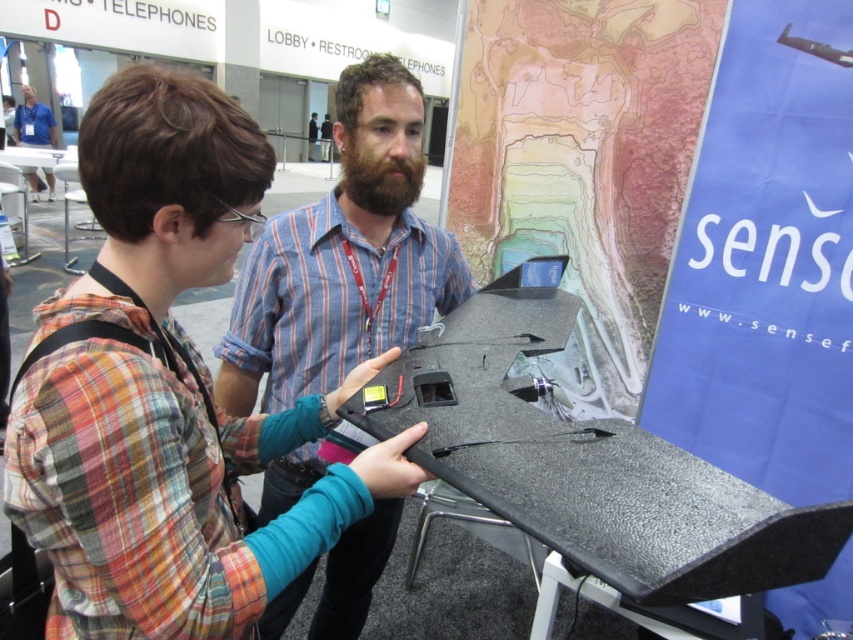
Which is above, plaid shirt at center or matte blue shirt at center?

Positioned higher is plaid shirt at center.

Is plaid shirt at center positioned before matte blue shirt at center?

Yes.

Between point (170, 561) and point (347, 216), which one is positioned behind?

The point (347, 216) is more distant.

Where is `plaid shirt at center`? This screenshot has width=853, height=640. plaid shirt at center is located at coordinates (167, 392).

Which is behind, point (389, 515) or point (32, 125)?

Positioned behind is point (32, 125).

Which is behind, point (251, 273) or point (21, 122)?

The point (21, 122) is behind.

This screenshot has width=853, height=640. I want to click on matte blue shirt at center, so click(343, 257).

Is plaid shirt at center bigger than matte blue shirt at upper left?

Indeed, plaid shirt at center has a larger size compared to matte blue shirt at upper left.

Who is higher up, plaid shirt at center or matte blue shirt at upper left?

matte blue shirt at upper left

Between point (303, 428) and point (38, 104), which one is positioned in front?

Positioned in front is point (303, 428).

Locate an element on the screen. This screenshot has width=853, height=640. plaid shirt at center is located at coordinates (167, 392).